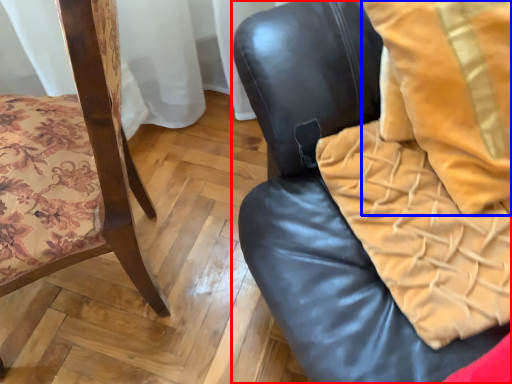
Question: Which object appears farthest to the camera in this image, chair (highlighted by a red box) or throw pillow (highlighted by a blue box)?

Choices:
 (A) chair
 (B) throw pillow

Answer: (B)